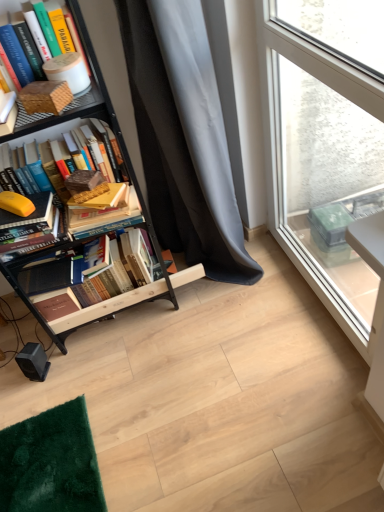
Locate an element on the screen. This screenshot has height=512, width=384. free space between black metal bookcase at left and gray fabric curtain at center is located at coordinates (153, 332).